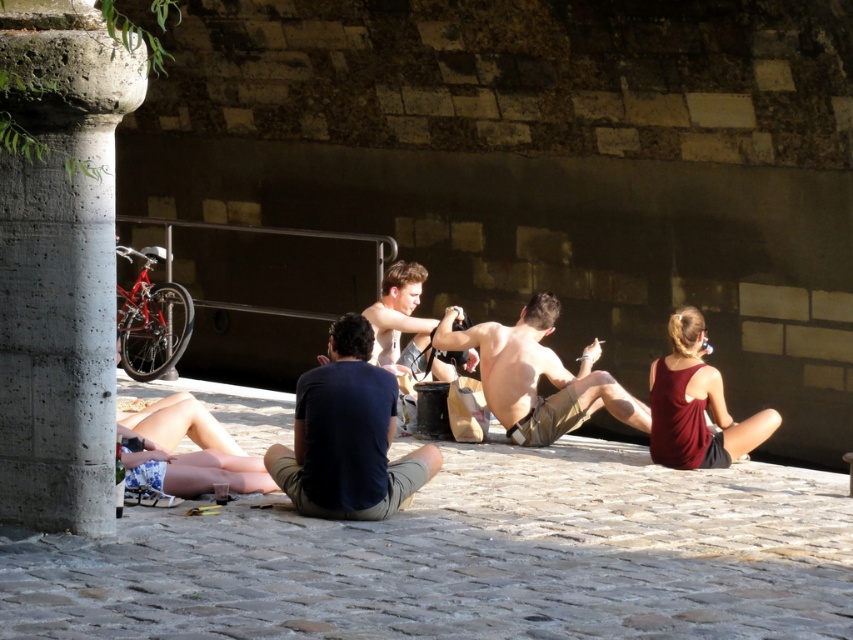
You are a photographer capturing a candid shot of the scene. You notice the shiny metallic phone at center and the smooth skin man at center. Which object is positioned lower in the frame?

The shiny metallic phone at center is located below the smooth skin man at center, so it is positioned lower in the frame.

You are standing in the urban area shown in the image. You see a concrete column at left and blue floral shorts at lower left. Which object is located more to the left side?

The concrete column at left is positioned on the left side of blue floral shorts at lower left, so the concrete column at left is more to the left side.